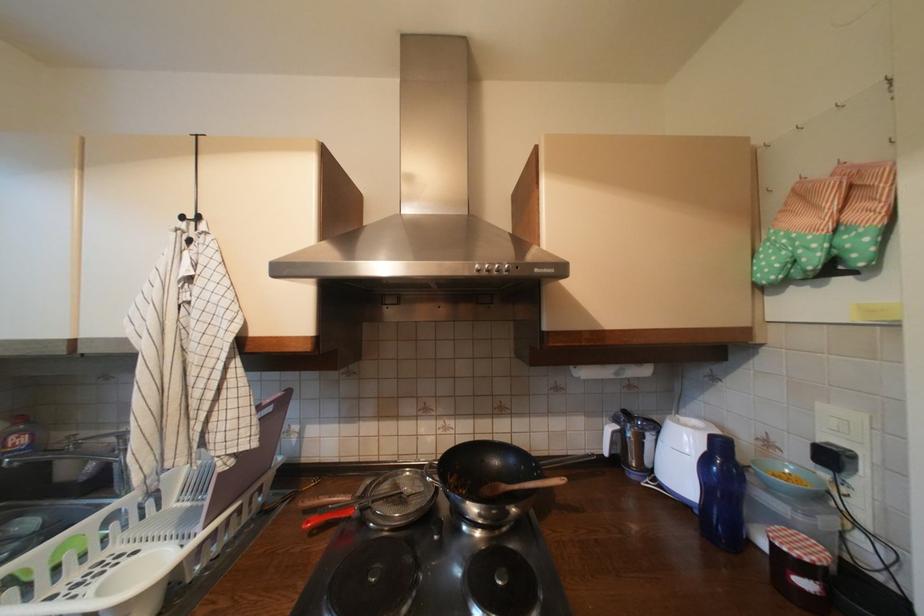
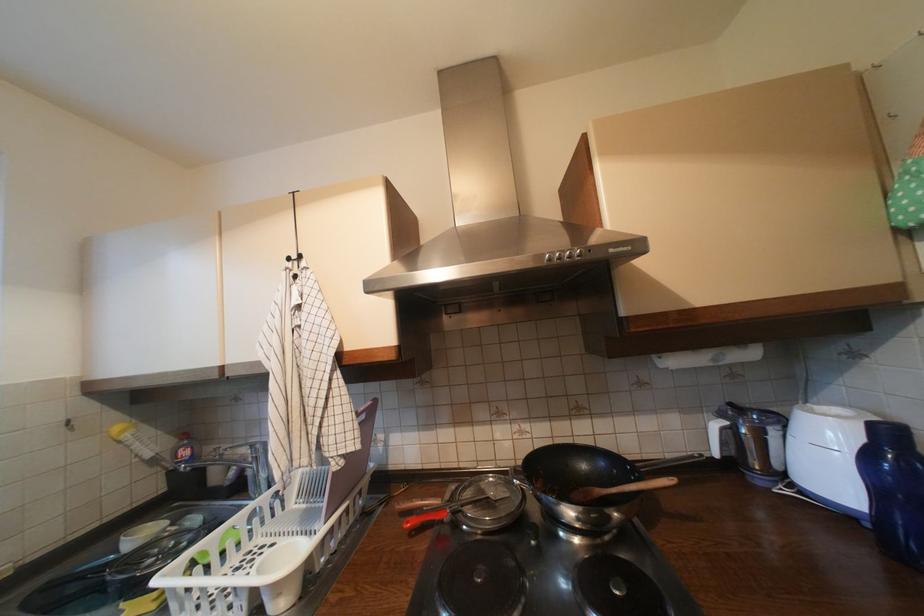
In the second image, find the point that corresponds to point 584,369 in the first image.

(669, 359)